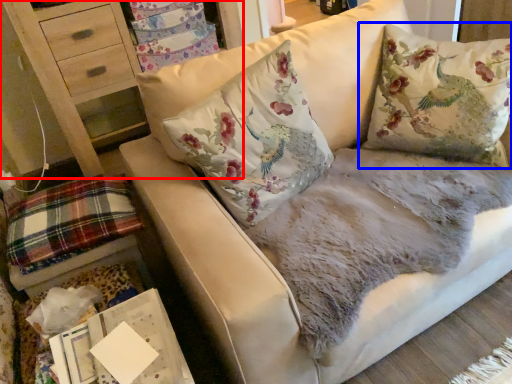
Question: Among these objects, which one is farthest to the camera, furniture (highlighted by a red box) or pillow (highlighted by a blue box)?

Choices:
 (A) furniture
 (B) pillow

Answer: (A)